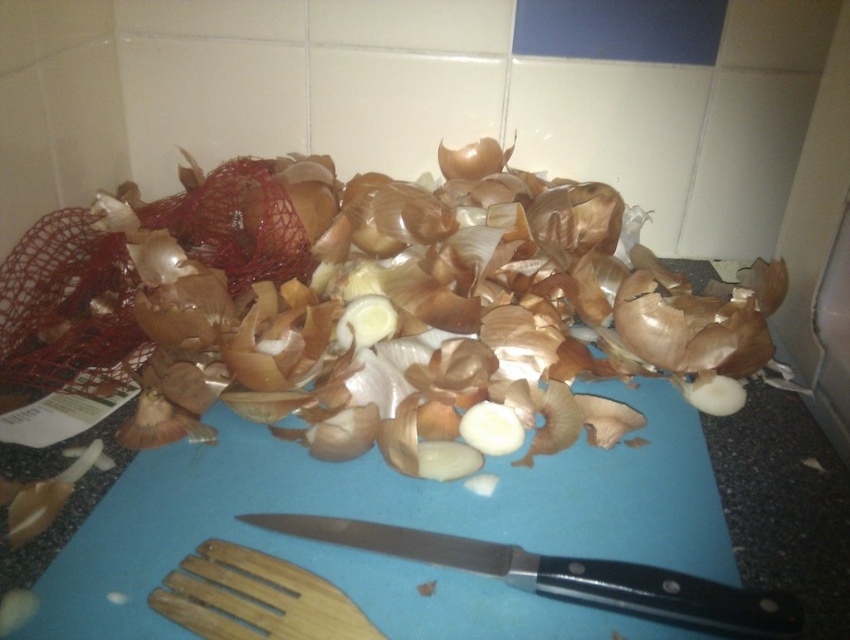
Question: Which of the following is the farthest from the observer?

Choices:
 (A) brown matte onion at center
 (B) black plastic knife at center

Answer: (A)

Question: Is the position of blue plastic cutting board at center less distant than that of brown matte onion at center?

Choices:
 (A) no
 (B) yes

Answer: (B)

Question: Considering the real-world distances, which object is farthest from the blue plastic cutting board at center?

Choices:
 (A) black plastic knife at center
 (B) brown matte onion at center

Answer: (B)

Question: Which point is farther to the camera?

Choices:
 (A) (264, 483)
 (B) (477, 173)
 (C) (609, 609)
 (D) (251, 621)

Answer: (B)

Question: Does blue plastic cutting board at center appear on the right side of wooden fork at lower left?

Choices:
 (A) yes
 (B) no

Answer: (A)

Question: From the image, what is the correct spatial relationship of black plastic knife at center in relation to wooden fork at lower left?

Choices:
 (A) right
 (B) left

Answer: (A)